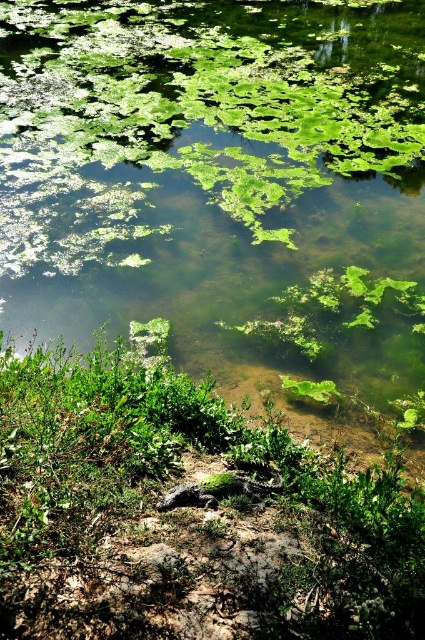
Question: Observing the image, what is the correct spatial positioning of green algae at bottom in reference to green leafy plant at center?

Choices:
 (A) below
 (B) above

Answer: (B)

Question: Which point appears closest to the camera in this image?

Choices:
 (A) (297, 582)
 (B) (27, 202)

Answer: (A)

Question: Which object appears closest to the camera in this image?

Choices:
 (A) green algae at bottom
 (B) green leafy plant at center

Answer: (B)

Question: Can you confirm if green algae at bottom is positioned to the left of green leafy plant at center?

Choices:
 (A) yes
 (B) no

Answer: (B)

Question: Which object is closer to the camera taking this photo?

Choices:
 (A) green leafy plant at center
 (B) green algae at bottom

Answer: (A)

Question: Considering the relative positions of green algae at bottom and green leafy plant at center in the image provided, where is green algae at bottom located with respect to green leafy plant at center?

Choices:
 (A) right
 (B) left

Answer: (A)